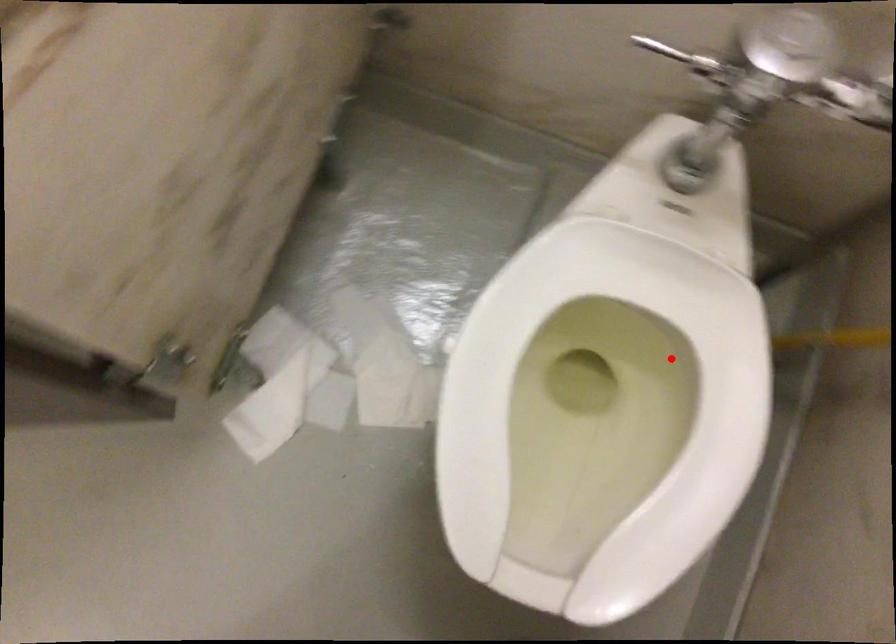
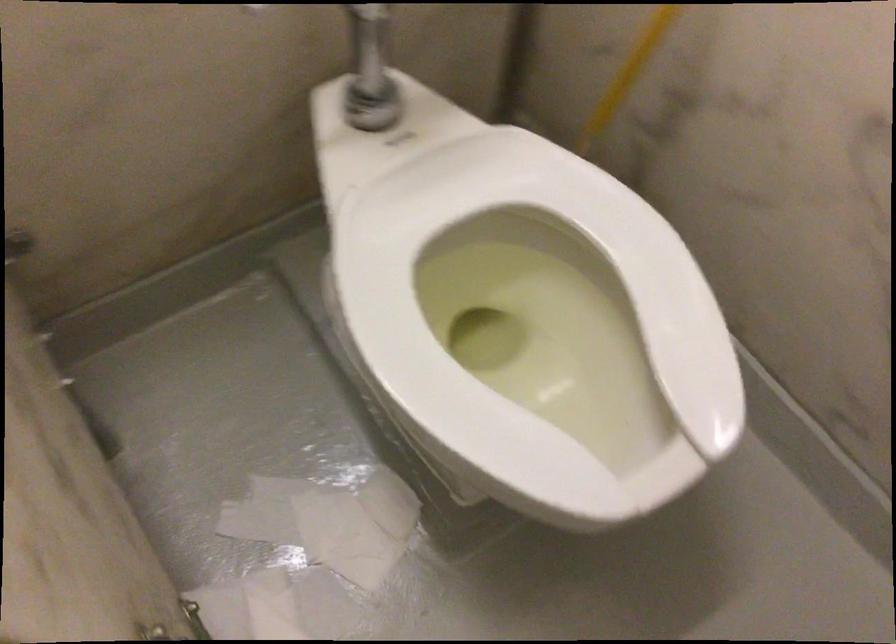
Locate, in the second image, the point that corresponds to the highlighted location in the first image.

(536, 254)